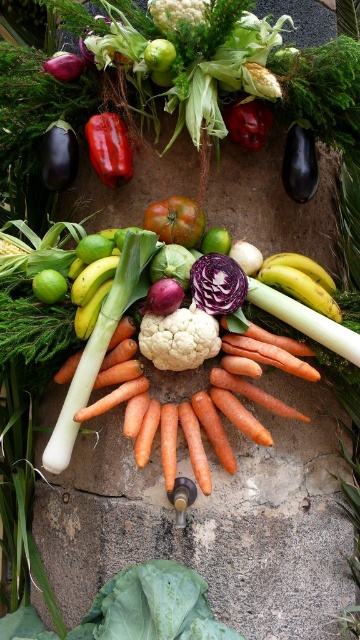
You are an interior designer analyzing the layout of this vegetable display. The matte black eggplant at left is part of a symmetrical design. Based on its position at point 0.244, 0.164, where would you expect the corresponding symmetrical element to be located?

The symmetrical counterpart to the matte black eggplant at left would be positioned at point (x=59, y=483), maintaining the horizontal axis of symmetry.

Looking at this image, you are standing in front of the vegetable display and want to reach the point at coordinates point (60, 189). However, there is an obstacle at point (253, 99). Can you directly reach the desired point without moving around the obstacle?

Since point (60, 189) is behind point (253, 99), you cannot directly reach it without moving around the obstacle at point (253, 99).